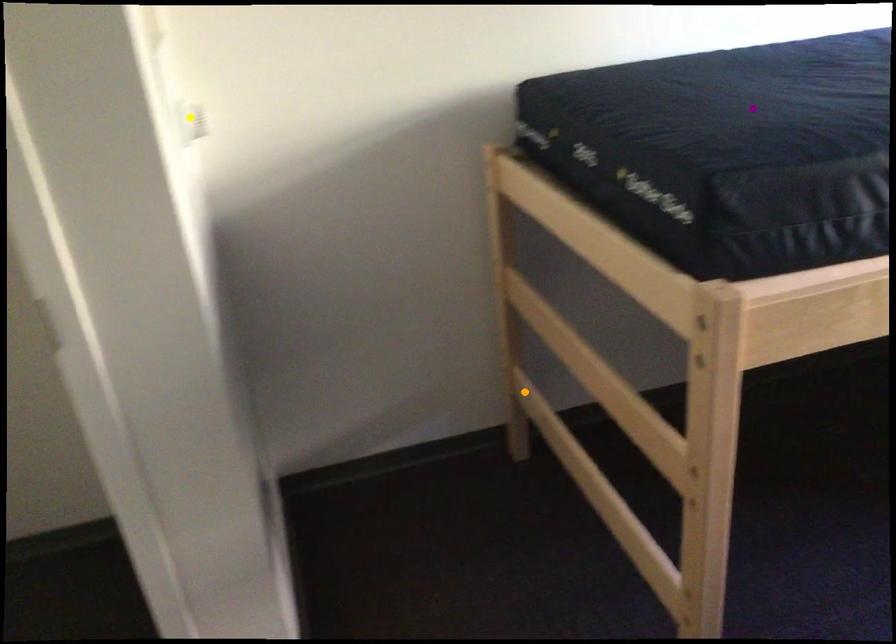
Order these from nearest to farthest:
yellow point, orange point, purple point

orange point
yellow point
purple point